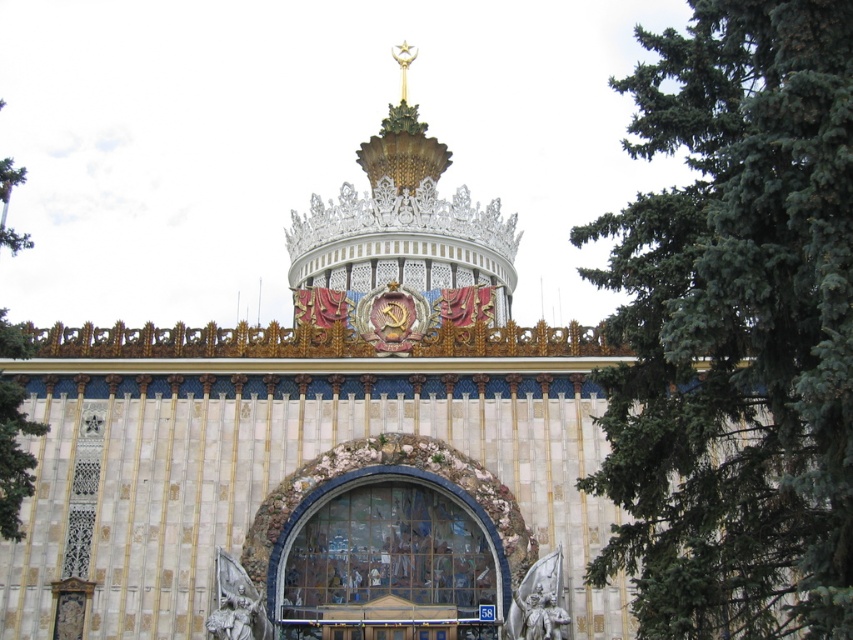
Based on the photo, you are standing in front of the grand building and want to determine the relative positions of two points on its facade. The first point is labeled as point (x=770, y=168), and the second is point (x=376, y=552). Which of these two points is closer to you?

Point (x=770, y=168) is closer to the viewer than point (x=376, y=552).